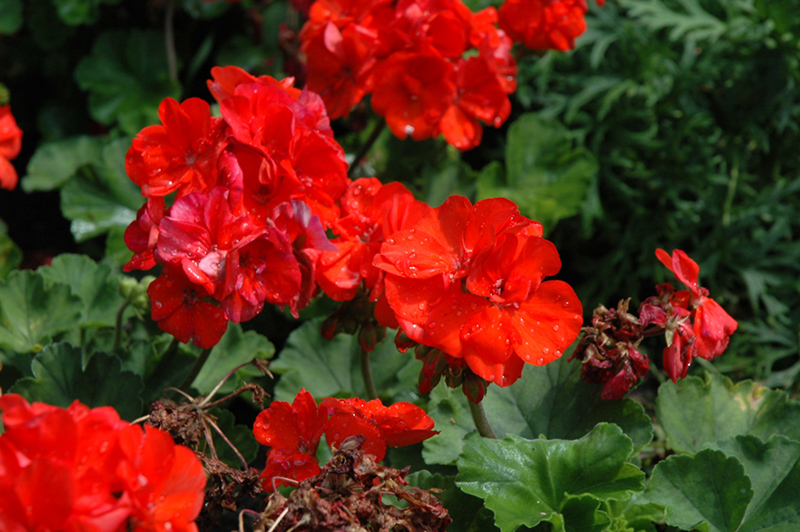
I want to click on dead flower, so click(341, 501).